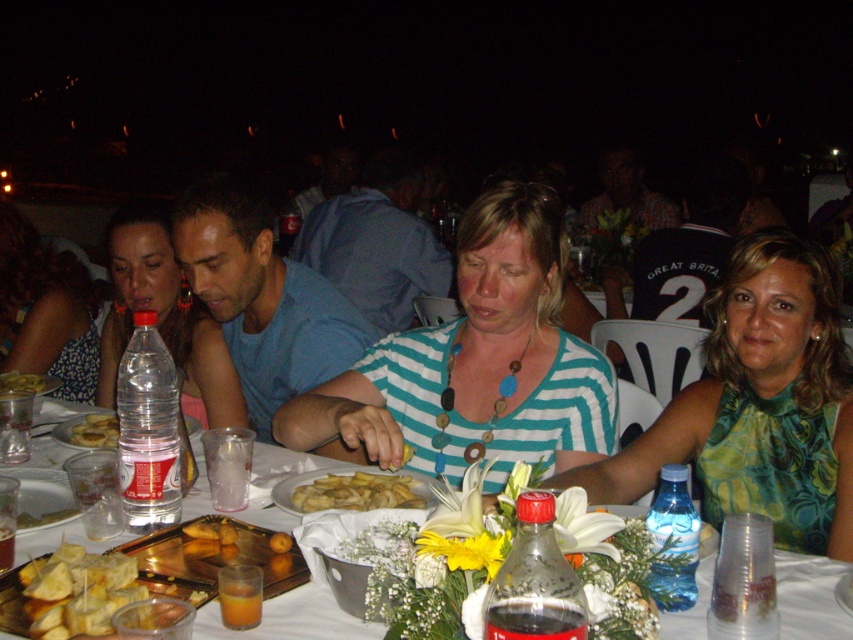
Question: Which object is the closest to the clear plastic bottle at table center?

Choices:
 (A) translucent plastic cup at table center
 (B) yellow fried chips at center
 (C) golden brown bread at center

Answer: (A)

Question: Which of the following is the farthest from the observer?

Choices:
 (A) green printed dress at center
 (B) golden brown bread at center
 (C) translucent plastic cup at table center
 (D) striped fabric shirt at center

Answer: (B)

Question: Can you confirm if yellow matte fries at center is positioned to the right of golden brown bread at center?

Choices:
 (A) yes
 (B) no

Answer: (A)

Question: Where is translucent plastic cup at table center located in relation to yellow fried chips at center in the image?

Choices:
 (A) above
 (B) below

Answer: (B)

Question: Which of the following is the closest to the observer?

Choices:
 (A) (10, 328)
 (B) (834, 627)
 (C) (341, 490)

Answer: (B)

Question: Is white floral dress at center above yellow crumbly cheese at center?

Choices:
 (A) no
 (B) yes

Answer: (B)